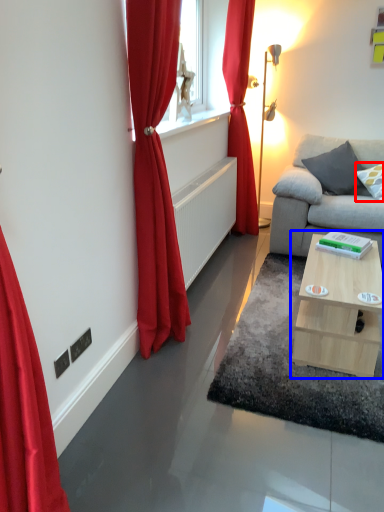
Question: Which object is closer to the camera taking this photo, pillow (highlighted by a red box) or table (highlighted by a blue box)?

Choices:
 (A) pillow
 (B) table

Answer: (B)